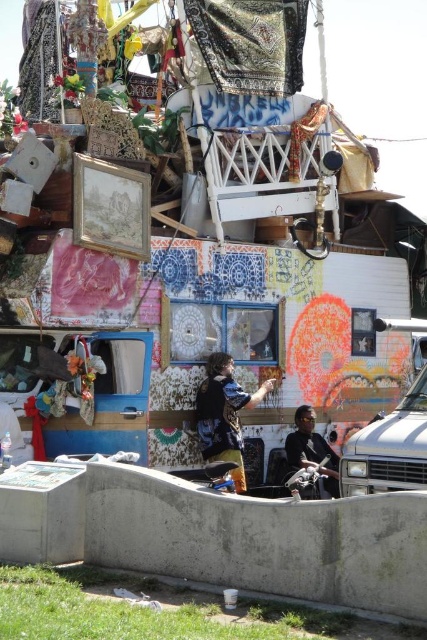
Is white matte truck at right in front of flannel shirt at center?

Yes.

Can you confirm if white matte truck at right is shorter than flannel shirt at center?

Indeed, white matte truck at right has a lesser height compared to flannel shirt at center.

Where is `white matte truck at right`? This screenshot has height=640, width=427. white matte truck at right is located at coordinates (388, 449).

Which is above, white painted truck at center or dark blue shirt at center?

white painted truck at center

Between point (260, 305) and point (318, 451), which one is positioned behind?

The point (318, 451) is behind.

Is point (338, 429) closer to viewer compared to point (307, 416)?

No.

What are the coordinates of `white painted truck at center` in the screenshot? It's located at (286, 330).

Who is more forward, (x=143, y=308) or (x=231, y=442)?

Point (x=143, y=308) is in front.

Does white painted truck at center appear under flannel shirt at center?

No.

The height and width of the screenshot is (640, 427). What are the coordinates of `white painted truck at center` in the screenshot? It's located at (286, 330).

The width and height of the screenshot is (427, 640). In order to click on white painted truck at center in this screenshot , I will do coord(286,330).